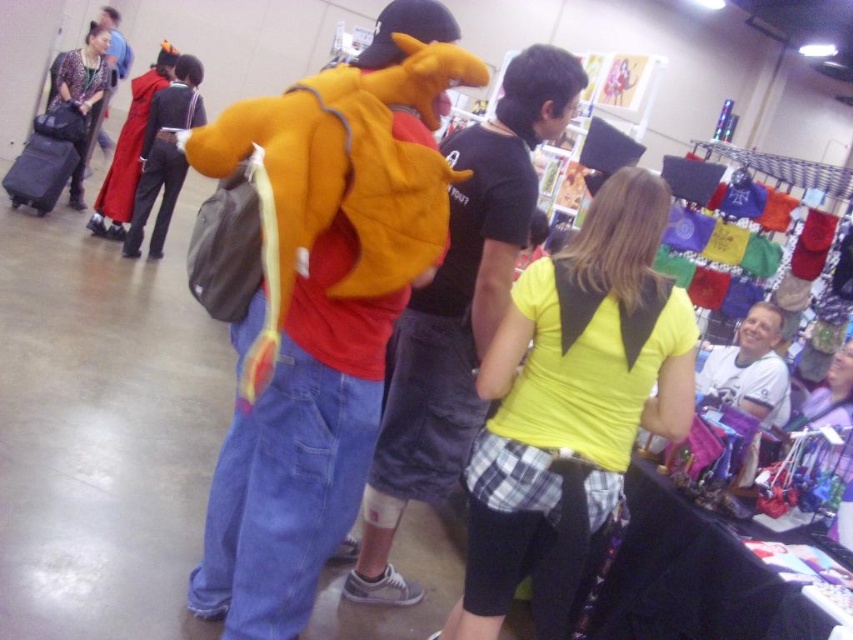
Is point (477, 632) farther from camera compared to point (128, 168)?

No, it is not.

Measure the distance between point (x=581, y=384) and camera.

Point (x=581, y=384) and camera are 5.74 feet apart from each other.

At what (x,y) coordinates should I click in order to perform the action: click on yellow matte shirt at center. Please return your answer as a coordinate pair (x, y). Looking at the image, I should click on (573, 388).

Does yellow matte shirt at center have a larger size compared to velvet red cape at upper left?

Correct, yellow matte shirt at center is larger in size than velvet red cape at upper left.

Between yellow matte shirt at center and velvet red cape at upper left, which one appears on the left side from the viewer's perspective?

From the viewer's perspective, velvet red cape at upper left appears more on the left side.

Between point (486, 433) and point (178, 54), which one is positioned behind?

The point (178, 54) is behind.

Image resolution: width=853 pixels, height=640 pixels. I want to click on yellow matte shirt at center, so click(x=573, y=388).

This screenshot has width=853, height=640. Describe the element at coordinates (129, 150) in the screenshot. I see `red fabric cape at upper left` at that location.

Is red fabric cape at upper left shorter than patterned fabric jacket at upper left?

Incorrect, red fabric cape at upper left's height does not fall short of patterned fabric jacket at upper left's.

Identify the location of red fabric cape at upper left. (129, 150).